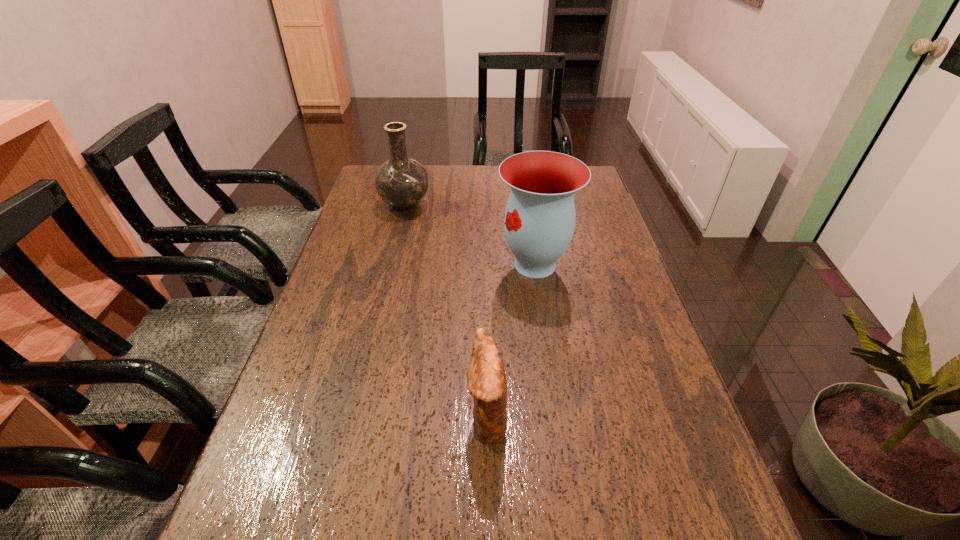
Find the location of `free space between the farther vase and the shortest object`. free space between the farther vase and the shortest object is located at coordinates (445, 311).

You are a GUI agent. You are given a task and a screenshot of the screen. Output one action in this format:
    pyautogui.click(x=<x>, y=<y>)
    Task: Click on the free space that is in between the nearest object and the nearer vase
    The height and width of the screenshot is (540, 960).
    Given the screenshot: What is the action you would take?
    point(511,341)

Find the location of a particular element. The image size is (960, 540). vacant space that is in between the left vase and the clutch bag is located at coordinates (445, 311).

Locate an element on the screen. The height and width of the screenshot is (540, 960). vacant region between the farthest object and the second farthest object is located at coordinates (470, 235).

I want to click on free spot between the nearest object and the right vase, so click(511, 341).

Where is `free space between the nearer vase and the nearest object`? The height and width of the screenshot is (540, 960). free space between the nearer vase and the nearest object is located at coordinates (511, 341).

Locate an element on the screen. This screenshot has height=540, width=960. vacant area that lies between the nearer vase and the left vase is located at coordinates (470, 235).

The width and height of the screenshot is (960, 540). I want to click on empty location between the farther vase and the clutch bag, so click(445, 311).

Identify the location of free space between the shortest object and the second farthest object. (511, 341).

Locate which object is the closest to the right vase. Please provide its 2D coordinates. Your answer should be formatted as a tuple, i.e. [(x, y)], where the tuple contains the x and y coordinates of a point satisfying the conditions above.

[(402, 182)]